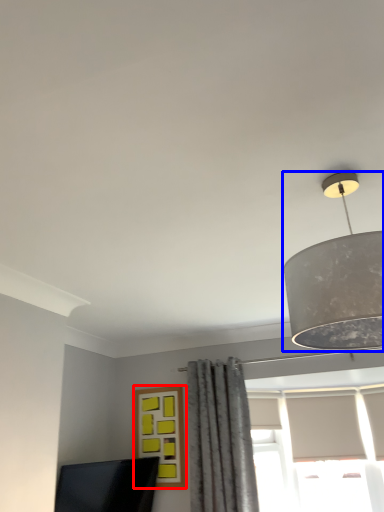
Question: Which point is further to the camera, window (highlighted by a red box) or lamp (highlighted by a blue box)?

Choices:
 (A) window
 (B) lamp

Answer: (A)